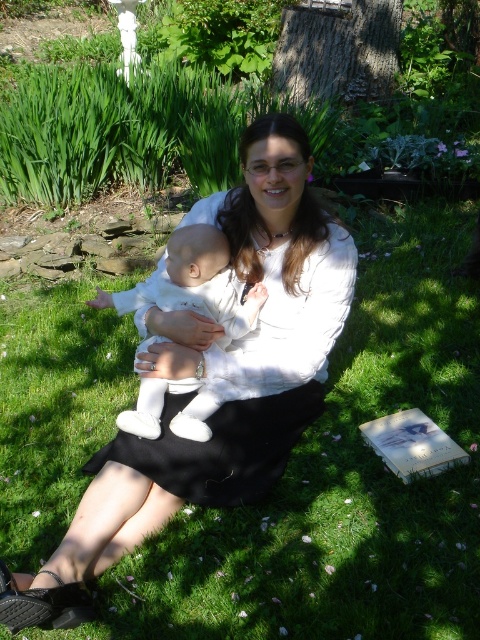
Question: Which point is farther to the camera?

Choices:
 (A) white soft fabric baby at center
 (B) white matte dress at center
 (C) black matte dress at center

Answer: (A)

Question: Is white matte dress at center to the left of black matte dress at center from the viewer's perspective?

Choices:
 (A) no
 (B) yes

Answer: (B)

Question: Which of the following is the closest to the observer?

Choices:
 (A) white matte dress at center
 (B) black matte dress at center

Answer: (A)

Question: Can you confirm if white matte dress at center is smaller than black matte dress at center?

Choices:
 (A) yes
 (B) no

Answer: (B)

Question: Is white matte dress at center positioned before black matte dress at center?

Choices:
 (A) no
 (B) yes

Answer: (B)

Question: Among these points, which one is nearest to the camera?

Choices:
 (A) (194, 422)
 (B) (167, 355)

Answer: (B)